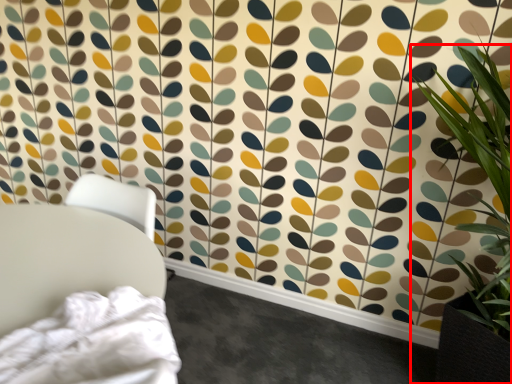
Question: Observing the image, what is the correct spatial positioning of houseplant (annotated by the red box) in reference to furniture?

Choices:
 (A) left
 (B) right

Answer: (B)